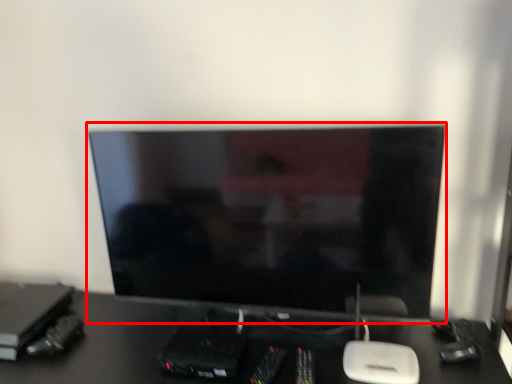
Question: Where is computer monitor (annotated by the red box) located in relation to desk in the image?

Choices:
 (A) left
 (B) right

Answer: (B)